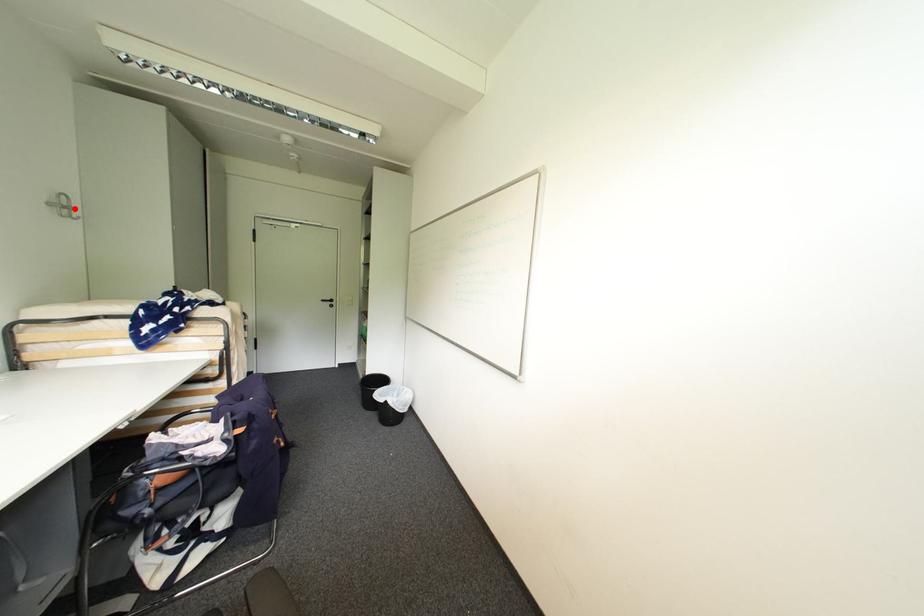
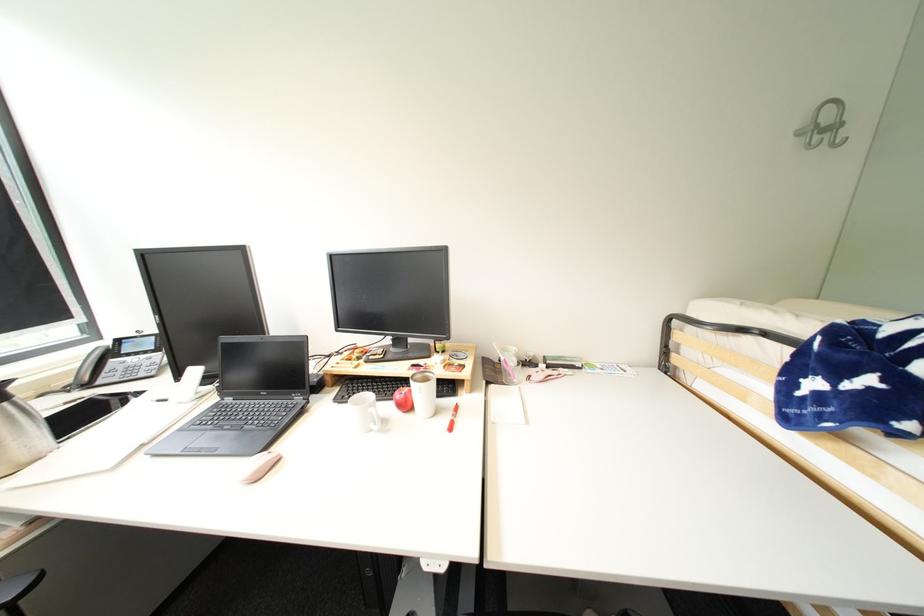
Where in the second image is the point corresponding to the highlighted location from the first image?

(841, 128)